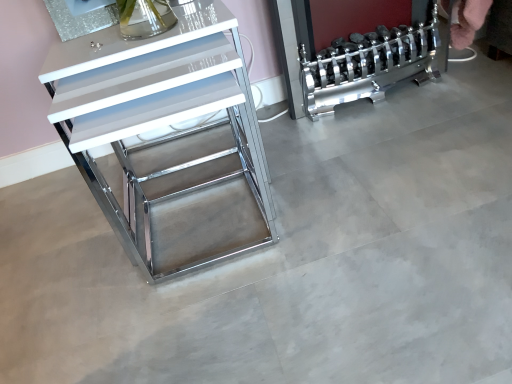
The width and height of the screenshot is (512, 384). I want to click on vacant space to the right of white glossy drawer at left, so click(x=371, y=162).